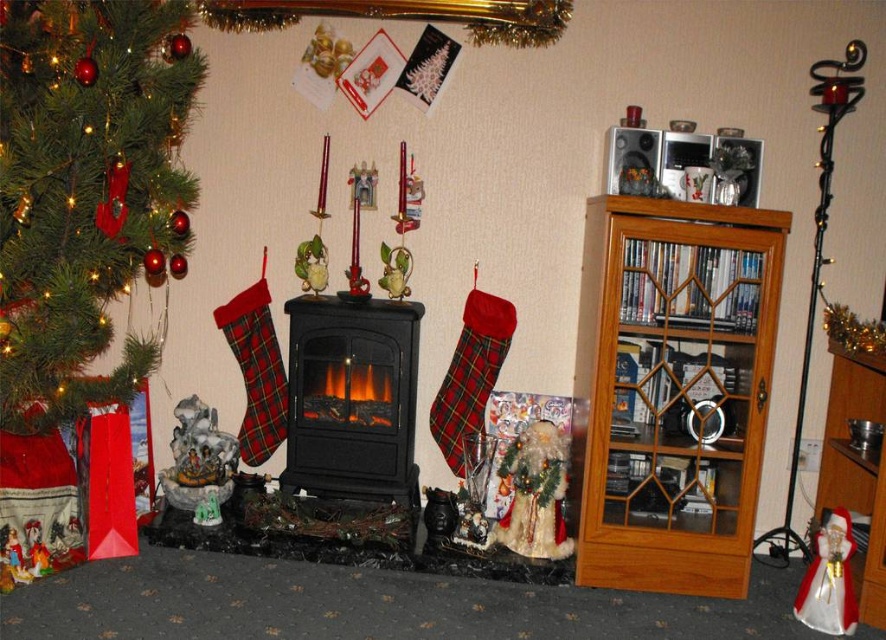
Question: Among these points, which one is nearest to the camera?

Choices:
 (A) (748, 480)
 (B) (33, 13)
 (C) (372, 326)
 (D) (828, 445)

Answer: (B)

Question: Which object appears closest to the camera in this image?

Choices:
 (A) black matte fireplace at center
 (B) light brown wooden bookshelf at right
 (C) green matte christmas tree at left
 (D) wooden bookshelf at right

Answer: (C)

Question: Does black matte fireplace at center appear on the left side of wooden bookshelf at right?

Choices:
 (A) yes
 (B) no

Answer: (A)

Question: Does light brown wooden bookshelf at right appear over black matte fireplace at center?

Choices:
 (A) no
 (B) yes

Answer: (B)

Question: Does light brown wooden bookshelf at right come in front of green matte christmas tree at left?

Choices:
 (A) yes
 (B) no

Answer: (B)

Question: Which object is the closest to the black matte fireplace at center?

Choices:
 (A) wooden bookshelf at right
 (B) light brown wooden bookshelf at right

Answer: (B)